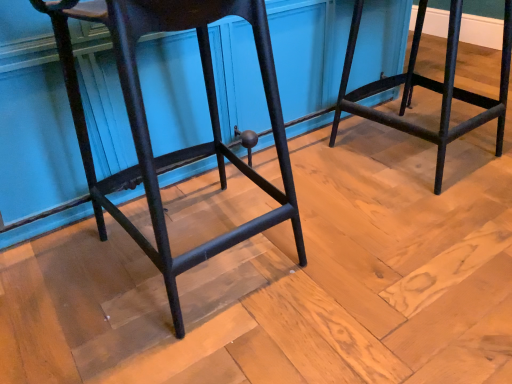
Where is `free point in front of black metal stool at right, which ranks as the first furniture in right-to-left order`? This screenshot has height=384, width=512. free point in front of black metal stool at right, which ranks as the first furniture in right-to-left order is located at coordinates (426, 216).